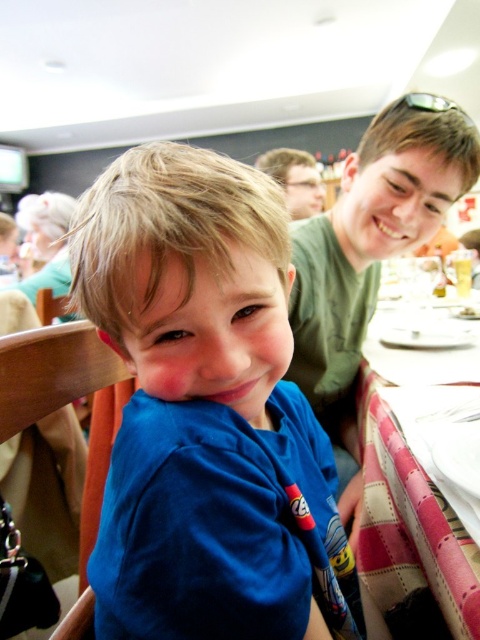
Based on the photo, you are a photographer trying to capture a closeup of the blue cotton shirt at right and the pink plaid tablecloth at lower right. Since you want both subjects to be in focus, you need to adjust your camera settings based on their sizes. Which subject should you focus on to ensure both are sharp?

The blue cotton shirt at right is wider than the pink plaid tablecloth at lower right. To ensure both are in focus, you should focus on the blue cotton shirt at right because it is larger and requires a smaller aperture or a higher fstop value to achieve the necessary depth of field.

You are a photographer trying to capture the boy in the blue cotton shirt at center and the pink plaid tablecloth at lower right. Which object is positioned higher in the image?

The blue cotton shirt at center is above the pink plaid tablecloth at lower right, so the blue cotton shirt at center is positioned higher in the image.

You are a photographer trying to capture a photo of both blue cotton shirts in the scene. Since the blue cotton shirt at center is shorter than the blue cotton shirt at right, which one should you adjust your camera angle to focus on first to ensure both are in frame?

To ensure both the blue cotton shirt at center and the blue cotton shirt at right are in frame, adjust your camera angle to focus on the blue cotton shirt at center first since it is shorter and closer to the camera. This allows the taller shirt at right to naturally come into view without cropping either.